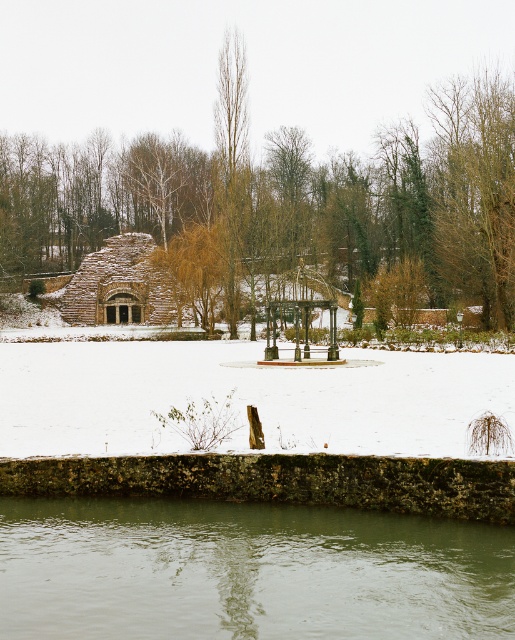
Between white powdery snow at center and bare wood tree at right, which one is positioned higher?

bare wood tree at right

What do you see at coordinates (244, 397) in the screenshot? I see `white powdery snow at center` at bounding box center [244, 397].

The image size is (515, 640). In order to click on white powdery snow at center in this screenshot , I will do `click(244, 397)`.

Does rustic stone hut at center appear on the right side of wooden gazebo at center?

In fact, rustic stone hut at center is to the left of wooden gazebo at center.

Which of these two, rustic stone hut at center or wooden gazebo at center, stands shorter?

With less height is wooden gazebo at center.

Which is in front, point (98, 305) or point (290, 292)?

Point (290, 292) is in front.

Find the location of `rustic stone hut at center`. rustic stone hut at center is located at coordinates (121, 285).

Measure the distance between point [127,636] and camera.

They are 10.21 meters apart.

Measure the distance from greenish water at lower center to wooden gazebo at center.

greenish water at lower center is 31.96 meters away from wooden gazebo at center.

Image resolution: width=515 pixels, height=640 pixels. In order to click on greenish water at lower center in this screenshot , I will do `click(247, 572)`.

The height and width of the screenshot is (640, 515). What are the coordinates of `greenish water at lower center` in the screenshot? It's located at (x=247, y=572).